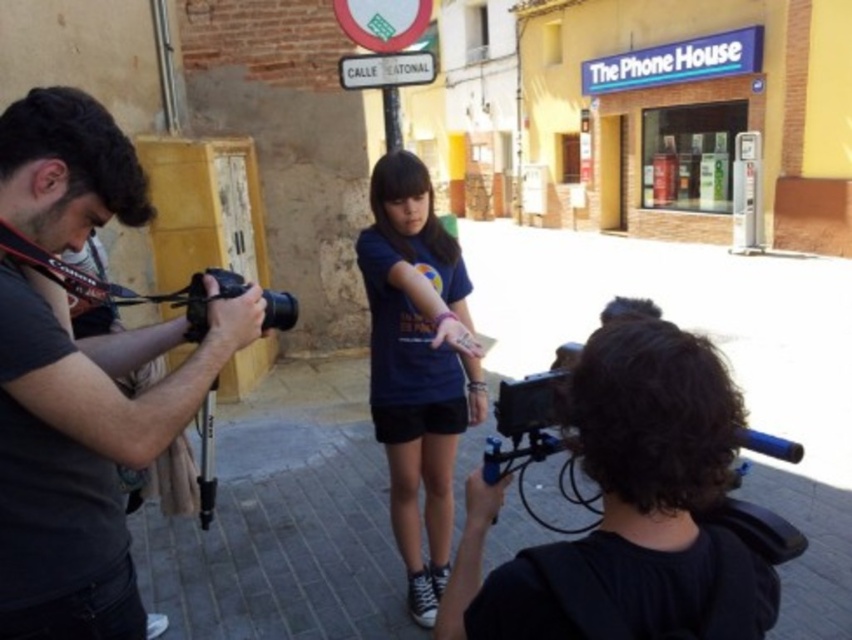
You are a photographer trying to adjust the lighting for the photo shoot. The subject is wearing a blue T shirt with a colorful graphic design and black shorts. Where is the photographer positioned relative to the dark gray shirt at left?

The photographer is positioned to the right of the dark gray shirt at left because the dark gray shirt at left is located at point (85, 456), which is on the left side of the frame.